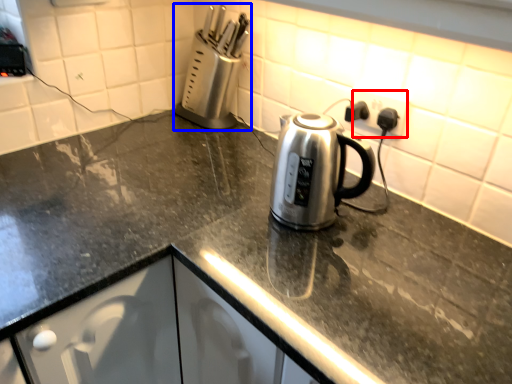
Question: Which object is closer to the camera taking this photo, electric outlet (highlighted by a red box) or appliance (highlighted by a blue box)?

Choices:
 (A) electric outlet
 (B) appliance

Answer: (A)